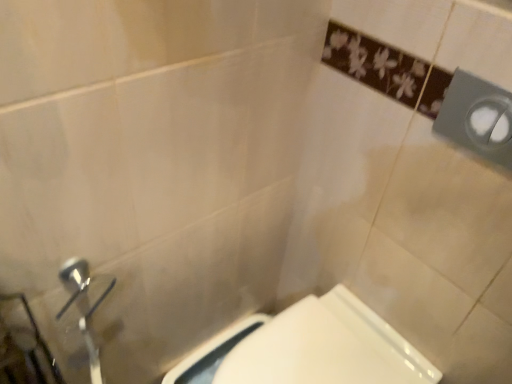
Question: Should I look upward or downward to see white glossy toilet at lower center?

Choices:
 (A) down
 (B) up

Answer: (A)